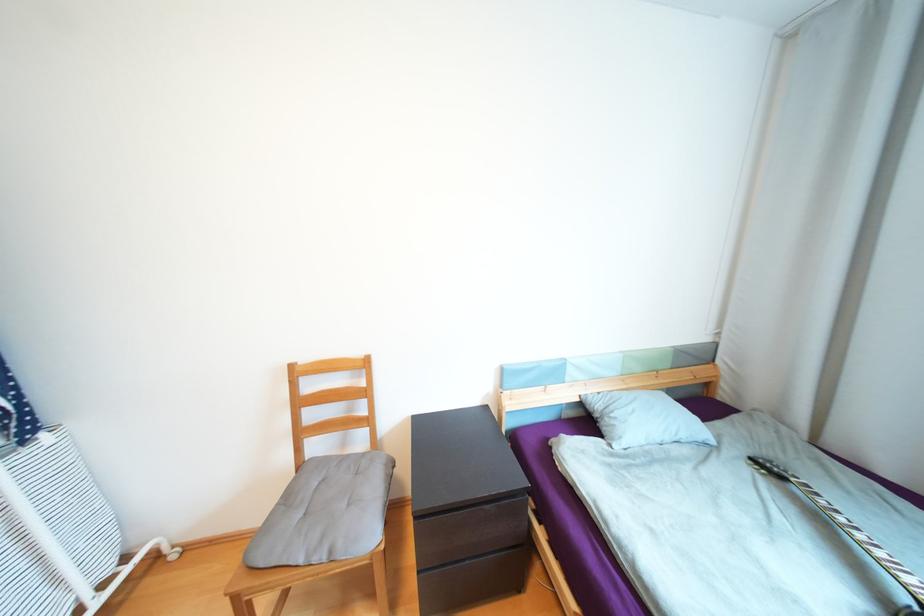
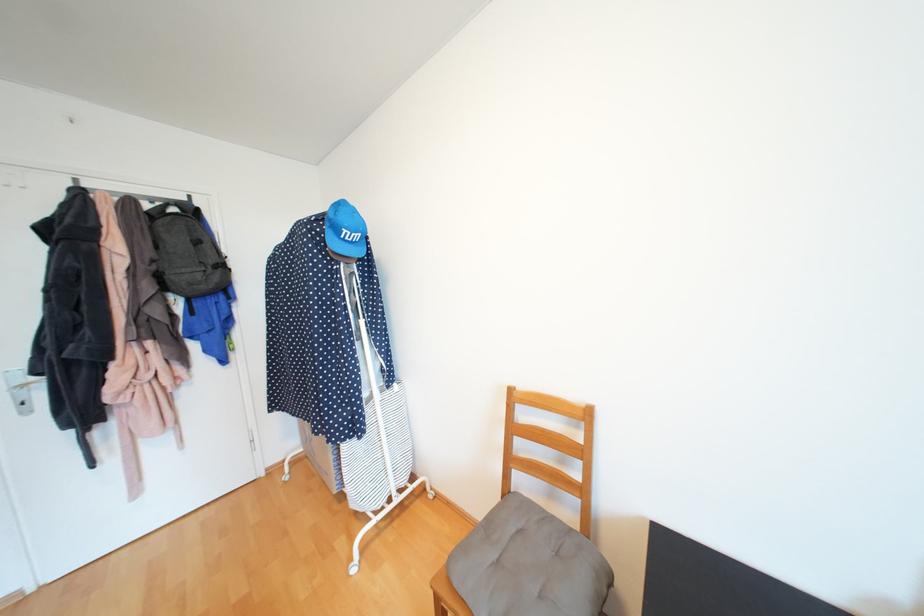
In the second image, find the point that corresponds to the point at 370,455 in the first image.

(577, 531)